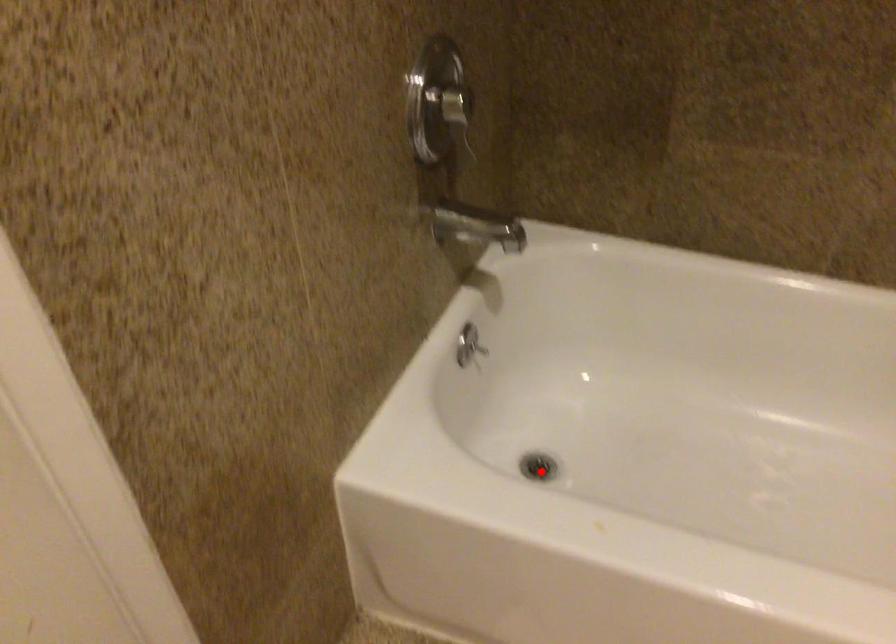
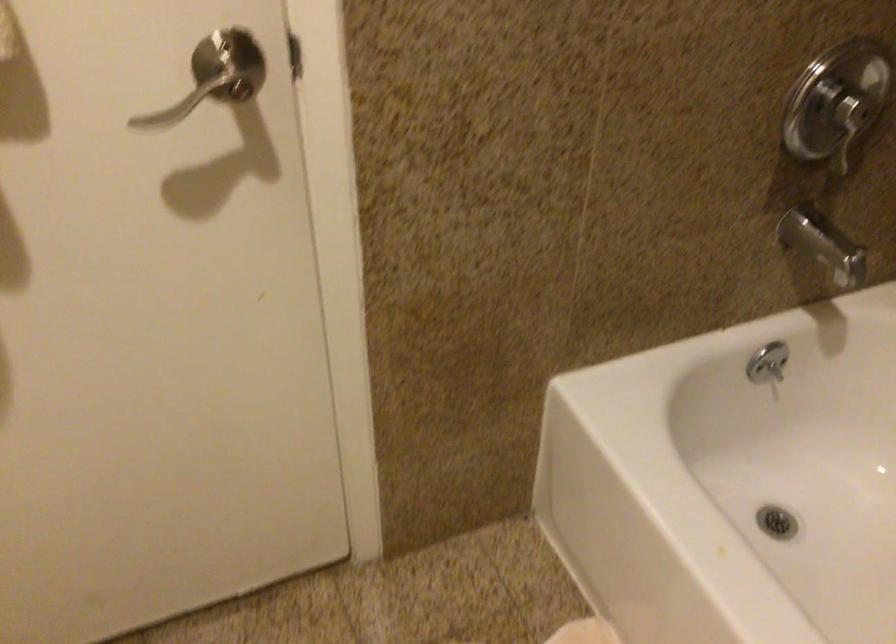
Question: I am providing you with two images of the same scene from different viewpoints. A red point is marked on the first image. Is the red point's position out of view in image 2?

Choices:
 (A) Yes
 (B) No

Answer: (B)